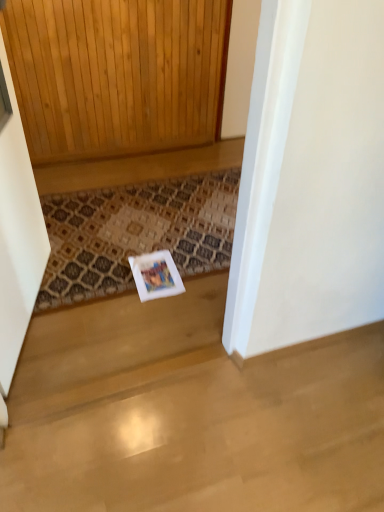
Describe the element at coordinates (17, 230) in the screenshot. Image resolution: width=384 pixels, height=512 pixels. I see `white wood screen door at left` at that location.

Find the location of a particular element. The height and width of the screenshot is (512, 384). white wood screen door at left is located at coordinates (17, 230).

What is the approximate height of patterned carpet at center?

The height of patterned carpet at center is 1.35 inches.

Describe the element at coordinates (135, 233) in the screenshot. Image resolution: width=384 pixels, height=512 pixels. I see `patterned carpet at center` at that location.

Identify the location of patterned carpet at center. This screenshot has height=512, width=384. (135, 233).

Find the location of a particular element. This screenshot has width=384, height=512. white wood screen door at left is located at coordinates (17, 230).

Does patterned carpet at center appear on the right side of white wood screen door at left?

Correct, you'll find patterned carpet at center to the right of white wood screen door at left.

Considering their positions, is patterned carpet at center located in front of or behind white wood screen door at left?

patterned carpet at center is behind white wood screen door at left.

Between point (205, 199) and point (11, 233), which one is positioned behind?

The point (205, 199) is farther from the camera.

From the image's perspective, is patterned carpet at center below white wood screen door at left?

Correct, patterned carpet at center appears lower than white wood screen door at left in the image.

Looking at this image, from a real-world perspective, is patterned carpet at center located beneath white wood screen door at left?

Yes, from a real-world perspective, patterned carpet at center is below white wood screen door at left.

Does patterned carpet at center have a lesser width compared to white wood screen door at left?

No.

Considering the relative sizes of patterned carpet at center and white wood screen door at left in the image provided, is patterned carpet at center shorter than white wood screen door at left?

Indeed, patterned carpet at center has a lesser height compared to white wood screen door at left.

In the scene shown: Does patterned carpet at center have a larger size compared to white wood screen door at left?

No, patterned carpet at center is not bigger than white wood screen door at left.

Looking at this image, do you think patterned carpet at center is within white wood screen door at left, or outside of it?

patterned carpet at center is not inside white wood screen door at left, it's outside.

Are patterned carpet at center and white wood screen door at left making contact?

No, patterned carpet at center is not touching white wood screen door at left.

Does patterned carpet at center turn towards white wood screen door at left?

No, patterned carpet at center is not aimed at white wood screen door at left.

This screenshot has width=384, height=512. What are the coordinates of `doormat located on the right of white wood screen door at left` in the screenshot? It's located at (135, 233).

Does white wood screen door at left appear on the right side of patterned carpet at center?

Incorrect, white wood screen door at left is not on the right side of patterned carpet at center.

Is white wood screen door at left in front of or behind patterned carpet at center in the image?

Clearly, white wood screen door at left is in front of patterned carpet at center.

Is point (8, 298) closer to viewer compared to point (167, 227)?

That is True.

From the image's perspective, is white wood screen door at left located above or below patterned carpet at center?

white wood screen door at left is situated higher than patterned carpet at center in the image.

From a real-world perspective, between white wood screen door at left and patterned carpet at center, who is vertically higher?

In real-world perspective, white wood screen door at left is above.

Considering the relative sizes of white wood screen door at left and patterned carpet at center in the image provided, is white wood screen door at left wider than patterned carpet at center?

Incorrect, the width of white wood screen door at left does not surpass that of patterned carpet at center.

Based on the photo, considering the relative sizes of white wood screen door at left and patterned carpet at center in the image provided, is white wood screen door at left shorter than patterned carpet at center?

No.

Looking at the image, does white wood screen door at left seem bigger or smaller compared to patterned carpet at center?

white wood screen door at left is bigger than patterned carpet at center.

Could patterned carpet at center be considered to be inside white wood screen door at left?

No, patterned carpet at center is located outside of white wood screen door at left.

Are white wood screen door at left and patterned carpet at center making contact?

There is a gap between white wood screen door at left and patterned carpet at center.

Is white wood screen door at left aimed at patterned carpet at center?

Yes, white wood screen door at left is aimed at patterned carpet at center.

How different are the orientations of white wood screen door at left and patterned carpet at center in degrees?

The facing directions of white wood screen door at left and patterned carpet at center are 73.7 degrees apart.

At what (x,y) coordinates should I click in order to perform the action: click on doormat behind the white wood screen door at left. Please return your answer as a coordinate pair (x, y). The width and height of the screenshot is (384, 512). Looking at the image, I should click on (135, 233).

Locate an element on the screen. doormat behind the white wood screen door at left is located at coordinates (135, 233).

Where is `doormat located underneath the white wood screen door at left (from a real-world perspective)`? This screenshot has height=512, width=384. doormat located underneath the white wood screen door at left (from a real-world perspective) is located at coordinates (135, 233).